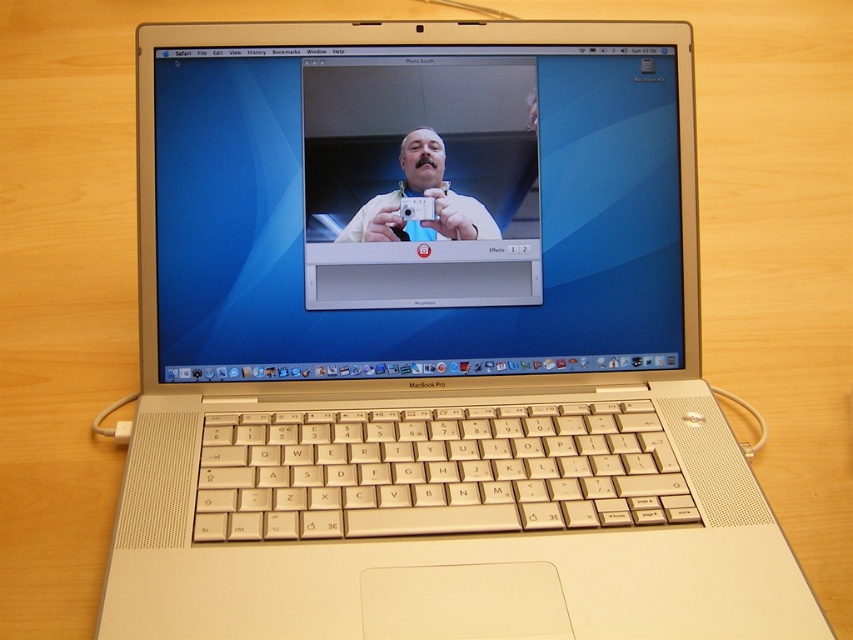
You are holding a white plastic camera at center and want to take a photo of the satin gold laptop at center. Since the camera has a minimum focus distance of 3 inches, will you be able to take a clear photo without moving either object?

The satin gold laptop at center is 3.25 inches from the white plastic camera at center. Since the camera requires a minimum focus distance of 3 inches, the distance is sufficient, so you can take a clear photo without moving either object.

You are a photographer trying to set up a tripod in front of the laptop. The tripod requires a minimum of 0.5 meters of space in front of the laptop to avoid obstruction. Given the laptop is at position coordinates point 0.347, 0.488, can you estimate if there is enough space in front of the satin gold laptop at center to place the tripod without blocking the camera view?

The satin gold laptop at center is positioned at coordinates point (415, 221). Since the laptop is placed on a wooden surface, there should be sufficient space in front of it to accommodate the tripod as long as the surface extends beyond the laptop by at least 0.5 meters. However, without knowing the total dimensions of the surface, it is impossible to confirm definitively. The answer would depend on the available space beyond the laptop.

You are setting up for a video call and notice both the satin gold laptop at center and the white plastic camera at center. Which device should you adjust first to ensure the camera is properly positioned for the call?

The satin gold laptop at center is located above the white plastic camera at center, so you should adjust the white plastic camera at center first to ensure it is properly positioned for the call.